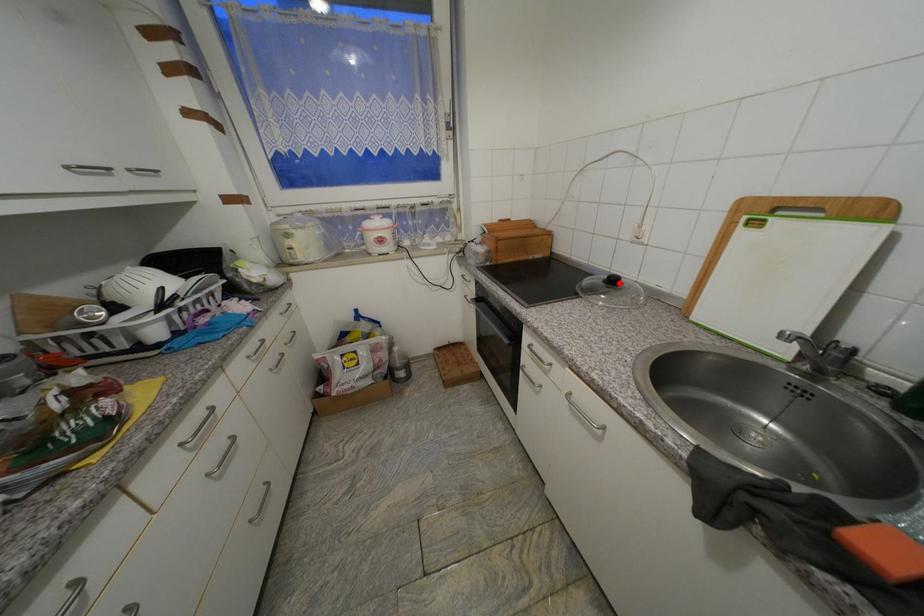
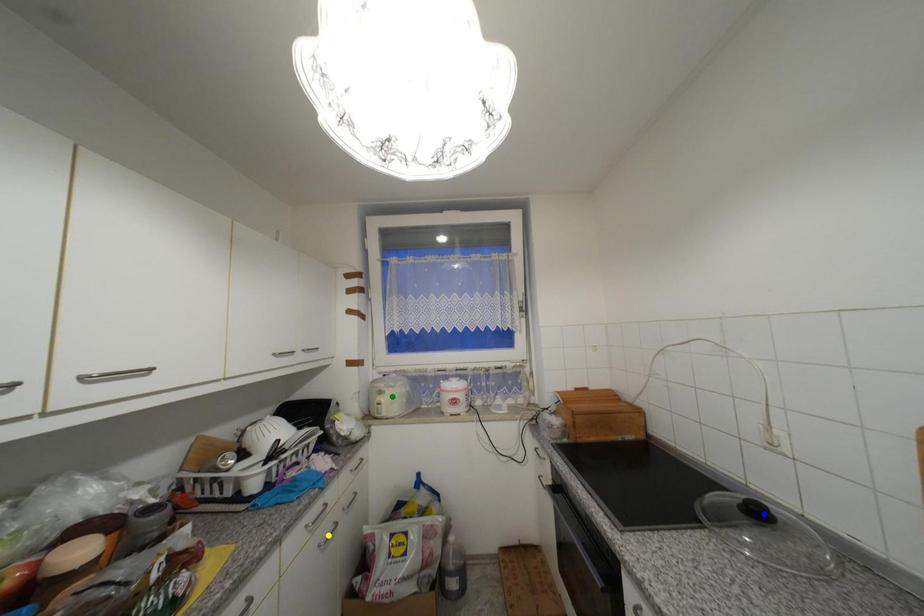
Question: I am providing you with two images of the same scene from different viewpoints. A red point is marked on the first image. You are given multiple points on the second image. Which point in image 2 is actually the same real-world point as the red point in image 1?

Choices:
 (A) yellow point
 (B) green point
 (C) blue point

Answer: (C)